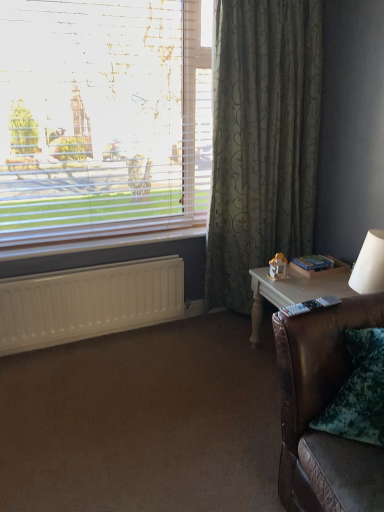
Question: Is white wood table at right oriented towards white plastic radiator at lower left?

Choices:
 (A) yes
 (B) no

Answer: (B)

Question: Is white wood table at right shorter than white plastic radiator at lower left?

Choices:
 (A) no
 (B) yes

Answer: (A)

Question: From the image's perspective, is white wood table at right below white plastic radiator at lower left?

Choices:
 (A) yes
 (B) no

Answer: (A)

Question: Is white wood table at right not within white plastic radiator at lower left?

Choices:
 (A) no
 (B) yes

Answer: (B)

Question: From a real-world perspective, is white wood table at right located beneath white plastic radiator at lower left?

Choices:
 (A) yes
 (B) no

Answer: (A)

Question: Considering their positions, is white matte radiator at lower left located in front of or behind white wood table at right?

Choices:
 (A) behind
 (B) front

Answer: (A)

Question: Is white matte radiator at lower left situated inside white wood table at right or outside?

Choices:
 (A) outside
 (B) inside

Answer: (A)

Question: Does point (77, 280) appear closer or farther from the camera than point (314, 294)?

Choices:
 (A) closer
 (B) farther

Answer: (B)

Question: In terms of size, does white matte radiator at lower left appear bigger or smaller than white wood table at right?

Choices:
 (A) big
 (B) small

Answer: (B)

Question: Is white wood table at right to the left or to the right of white matte radiator at lower left in the image?

Choices:
 (A) left
 (B) right

Answer: (B)

Question: From the image's perspective, is white wood table at right located above or below white matte radiator at lower left?

Choices:
 (A) above
 (B) below

Answer: (B)

Question: Relative to white matte radiator at lower left, is white wood table at right in front or behind?

Choices:
 (A) front
 (B) behind

Answer: (A)

Question: Is point (342, 271) closer or farther from the camera than point (8, 314)?

Choices:
 (A) closer
 (B) farther

Answer: (B)

Question: Would you say white matte radiator at lower left is inside or outside white blinds at upper left?

Choices:
 (A) inside
 (B) outside

Answer: (B)

Question: Considering the positions of white matte radiator at lower left and white blinds at upper left in the image, is white matte radiator at lower left wider or thinner than white blinds at upper left?

Choices:
 (A) wide
 (B) thin

Answer: (B)